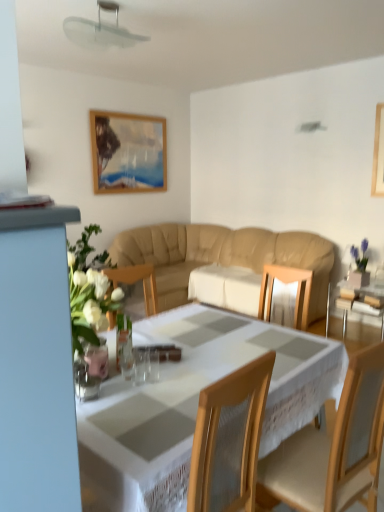
Question: Is beige leather couch at center wider or thinner than wooden chair at center?

Choices:
 (A) thin
 (B) wide

Answer: (B)

Question: In the image, is beige leather couch at center positioned in front of or behind wooden chair at center?

Choices:
 (A) behind
 (B) front

Answer: (A)

Question: Estimate the real-world distances between objects in this image. Which object is closer to the transparent glass table at right?

Choices:
 (A) clear glass vase at lower left
 (B) transparent plastic fan at upper center
 (C) beige leather couch at center
 (D) wooden chair at center
 (E) white lace tablecloth at center

Answer: (C)

Question: Which of these objects is positioned closest to the transparent glass table at right?

Choices:
 (A) clear glass vase at lower left
 (B) beige leather couch at center
 (C) white lace tablecloth at center
 (D) wooden chair at center
 (E) transparent plastic fan at upper center

Answer: (B)